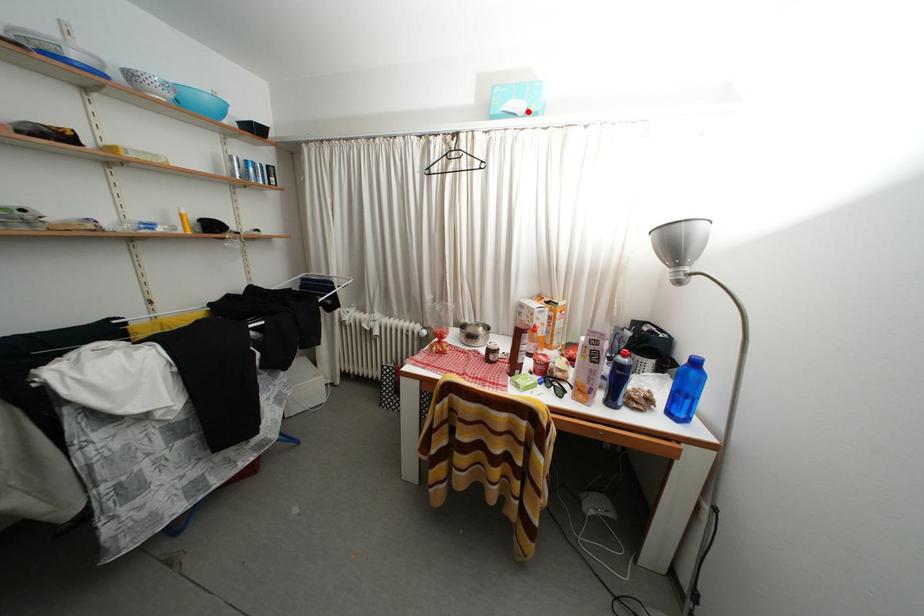
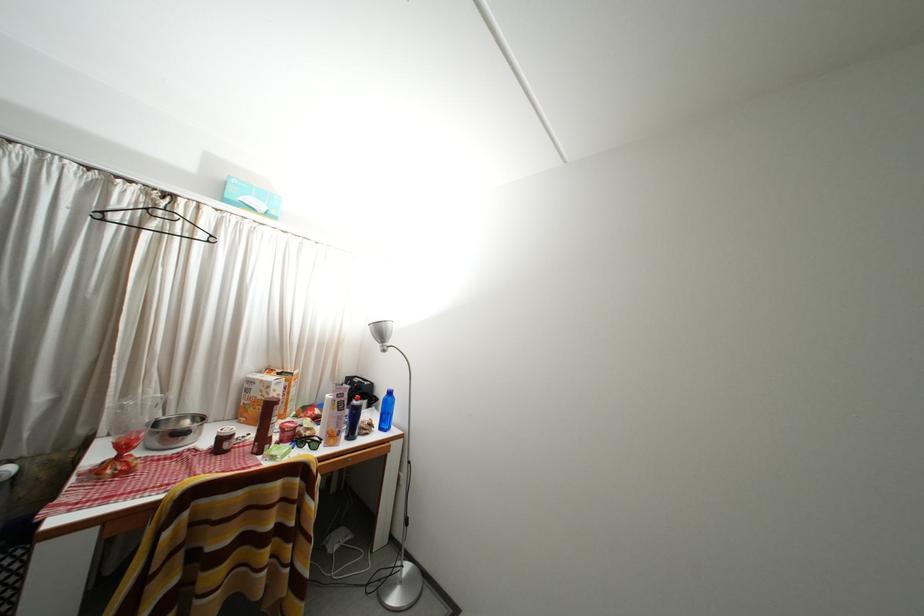
Locate, in the second image, the point that corresponds to the highlighted location in the first image.

(268, 211)